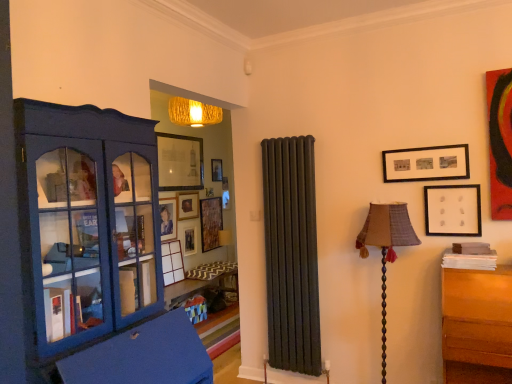
Question: From the image's perspective, would you say textured fabric lampshade at right is positioned over matte blue cabinet at left?

Choices:
 (A) no
 (B) yes

Answer: (A)

Question: Can you confirm if textured fabric lampshade at right is taller than matte blue cabinet at left?

Choices:
 (A) yes
 (B) no

Answer: (B)

Question: Does textured fabric lampshade at right turn towards matte blue cabinet at left?

Choices:
 (A) yes
 (B) no

Answer: (B)

Question: Considering the relative sizes of textured fabric lampshade at right and matte blue cabinet at left in the image provided, is textured fabric lampshade at right bigger than matte blue cabinet at left?

Choices:
 (A) no
 (B) yes

Answer: (A)

Question: Is textured fabric lampshade at right outside matte blue cabinet at left?

Choices:
 (A) yes
 (B) no

Answer: (A)

Question: From a real-world perspective, is matte black picture frame at upper right, which appears as the 2th picture frame when viewed from the front, positioned above or below matte black picture frame at center, the fifth picture frame when ordered from left to right?

Choices:
 (A) below
 (B) above

Answer: (B)

Question: Based on their positions, is matte black picture frame at upper right, the 6th picture frame from the back, located to the left or right of matte black picture frame at center, the fifth picture frame when ordered from left to right?

Choices:
 (A) right
 (B) left

Answer: (A)

Question: Is matte black picture frame at upper right, the 2th picture frame when ordered from right to left, situated inside matte black picture frame at center, which appears as the 1th picture frame when viewed from the back, or outside?

Choices:
 (A) inside
 (B) outside

Answer: (B)

Question: Considering the positions of matte black picture frame at upper right, which appears as the 2th picture frame when viewed from the front, and matte black picture frame at center, which is the 7th picture frame from front to back, in the image, is matte black picture frame at upper right, which appears as the 2th picture frame when viewed from the front, taller or shorter than matte black picture frame at center, which is the 7th picture frame from front to back,?

Choices:
 (A) short
 (B) tall

Answer: (A)

Question: Is white matte picture frame at upper right, the first picture frame from the front, situated inside matte blue cabinet at left or outside?

Choices:
 (A) outside
 (B) inside

Answer: (A)

Question: From the image's perspective, relative to matte blue cabinet at left, is white matte picture frame at upper right, the first picture frame from the front, above or below?

Choices:
 (A) below
 (B) above

Answer: (B)

Question: Does point (454, 210) appear closer or farther from the camera than point (60, 115)?

Choices:
 (A) closer
 (B) farther

Answer: (B)

Question: Looking at their shapes, would you say white matte picture frame at upper right, the 1th picture frame when ordered from right to left, is wider or thinner than matte blue cabinet at left?

Choices:
 (A) wide
 (B) thin

Answer: (B)

Question: Based on their positions, is matte black picture frame at upper right, the 2th picture frame when ordered from right to left, located to the left or right of matte wooden picture frame at center, positioned as the 7th picture frame in right-to-left order?

Choices:
 (A) right
 (B) left

Answer: (A)

Question: Looking at their shapes, would you say matte black picture frame at upper right, the 2th picture frame when ordered from right to left, is wider or thinner than matte wooden picture frame at center, positioned as the 7th picture frame in right-to-left order?

Choices:
 (A) thin
 (B) wide

Answer: (B)